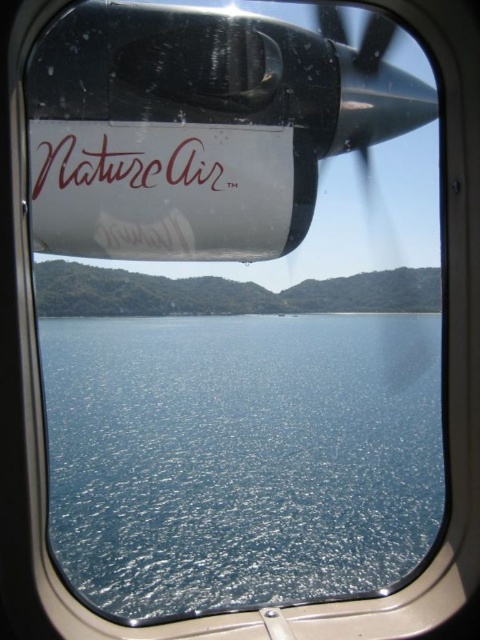
You are a passenger on an airplane and you notice the blue glossy water at center and the browncursive text at center through the window. How far apart are these two objects from each other?

The blue glossy water at center is 48.28 meters away from the browncursive text at center.

You are a passenger on the aircraft and want to take a photo of the browncursive text at center and the blue glossy water at center. Which object is positioned higher in the image?

The browncursive text at center is positioned higher than the blue glossy water at center in the image.

You are a passenger on the aircraft and want to know if the blue glossy water at center is wider than the browncursive text at center. Can you confirm?

The blue glossy water at center is wider than the browncursive text at center because its width surpasses the latter.